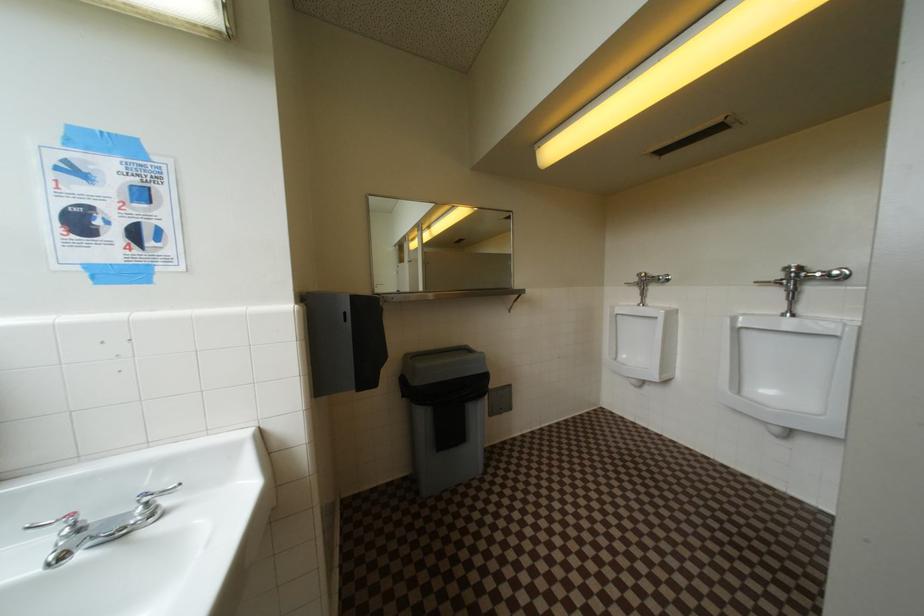
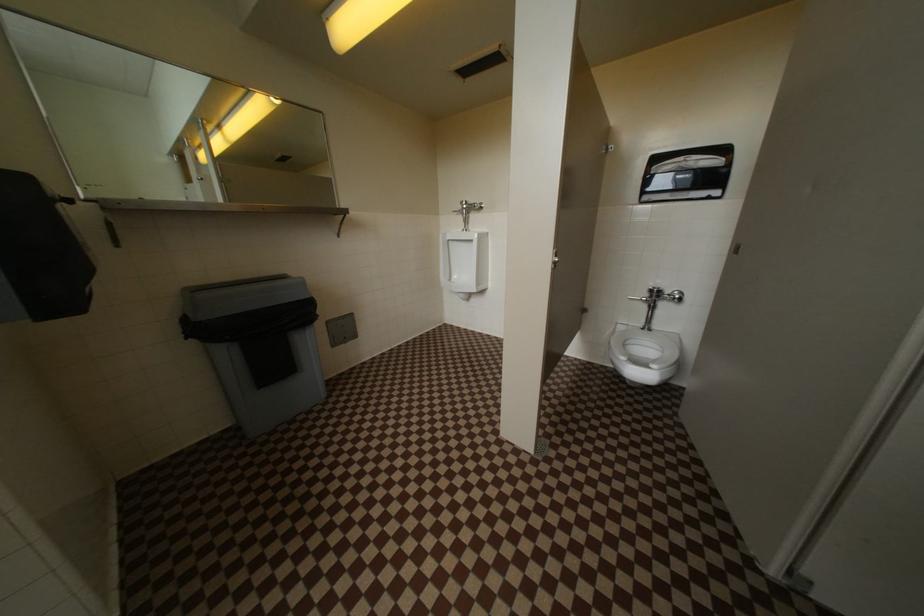
Question: The first image is from the beginning of the video and the second image is from the end. How did the camera likely rotate when shooting the video?

Choices:
 (A) Left
 (B) Right
 (C) Up
 (D) Down

Answer: (B)